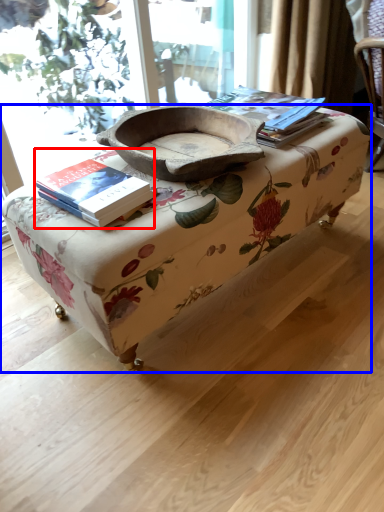
Question: Among these objects, which one is farthest to the camera, book (highlighted by a red box) or table (highlighted by a blue box)?

Choices:
 (A) book
 (B) table

Answer: (A)